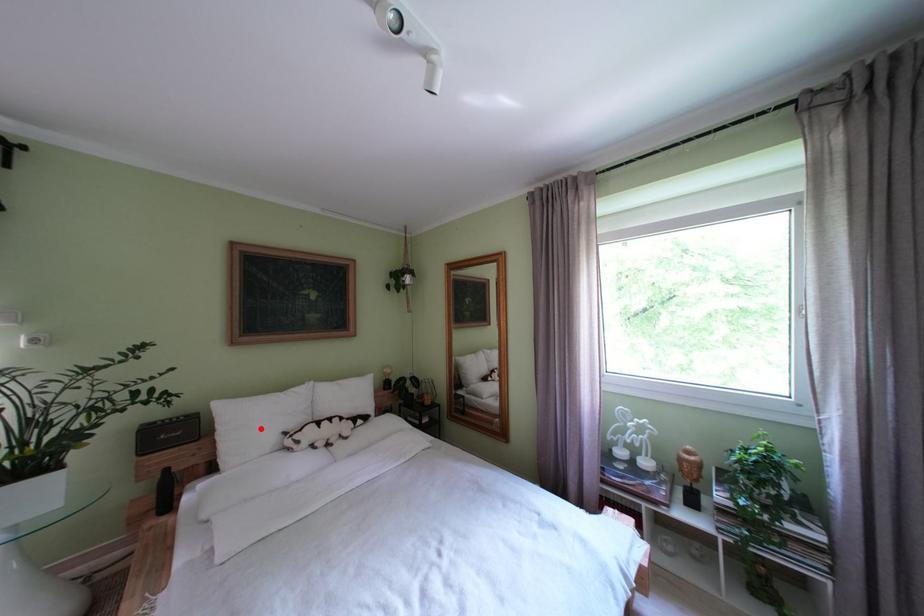
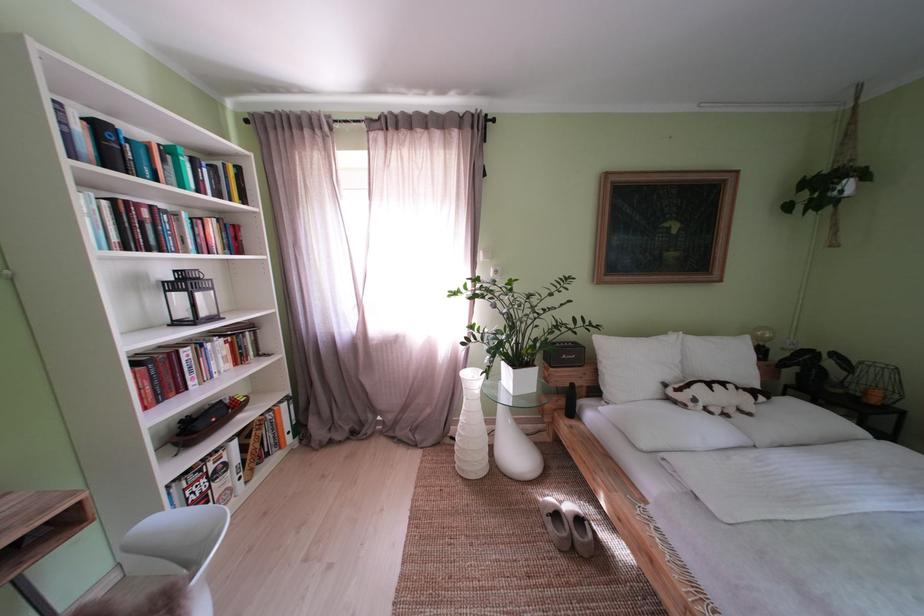
Question: I am providing you with two images of the same scene from different viewpoints. A red point is marked on the first image. Is the red point's position out of view in image 2?

Choices:
 (A) Yes
 (B) No

Answer: (B)